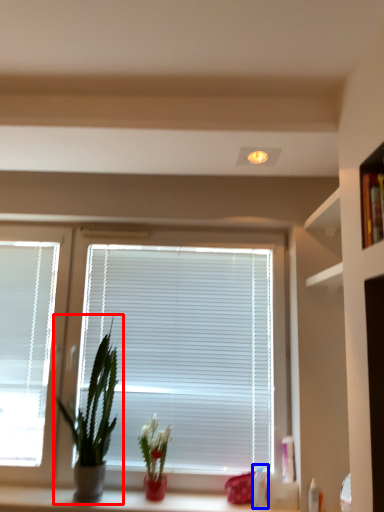
Question: Which object is closer to the camera taking this photo, houseplant (highlighted by a red box) or toiletry (highlighted by a blue box)?

Choices:
 (A) houseplant
 (B) toiletry

Answer: (A)